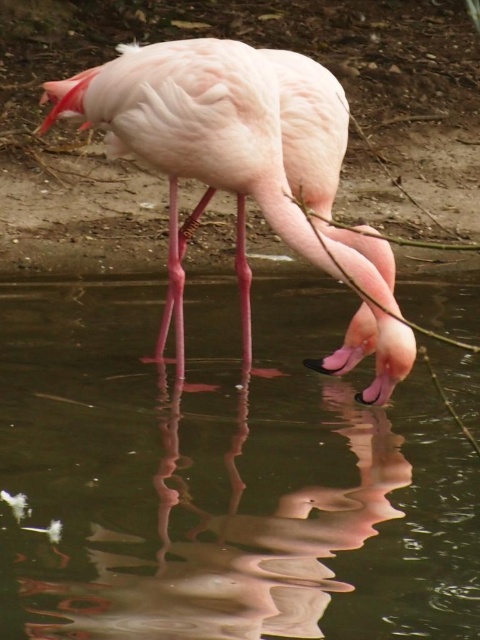
Question: Is transparent liquid water at center further to camera compared to pink feathered flamingo at center?

Choices:
 (A) yes
 (B) no

Answer: (B)

Question: Can you confirm if transparent liquid water at center is positioned above pink feathered flamingo at center?

Choices:
 (A) yes
 (B) no

Answer: (B)

Question: Is transparent liquid water at center smaller than pink feathered flamingo at center?

Choices:
 (A) yes
 (B) no

Answer: (B)

Question: Which point is closer to the camera?

Choices:
 (A) transparent liquid water at center
 (B) pink feathered flamingo at center

Answer: (A)

Question: Which object appears closest to the camera in this image?

Choices:
 (A) pink feathered flamingo at center
 (B) transparent liquid water at center

Answer: (B)